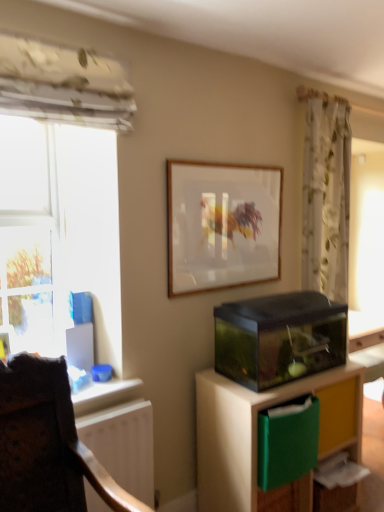
Question: Is point (74, 439) closer or farther from the camera than point (187, 194)?

Choices:
 (A) closer
 (B) farther

Answer: (A)

Question: From the image's perspective, is velvet dark brown chair at lower left positioned above or below wooden frame at upper center?

Choices:
 (A) above
 (B) below

Answer: (B)

Question: Which is farther from the transparent glass aquarium at lower right?

Choices:
 (A) wooden frame at upper center
 (B) velvet dark brown chair at lower left
 (C) floral fabric curtain at upper right
 (D) transparent glass aquarium at lower right
 (E) white matte radiator at lower left

Answer: (C)

Question: Estimate the real-world distances between objects in this image. Which object is farther from the wooden frame at upper center?

Choices:
 (A) transparent glass window at left
 (B) transparent glass aquarium at lower right
 (C) white matte radiator at lower left
 (D) transparent glass aquarium at lower right
 (E) floral fabric curtain at upper right

Answer: (C)